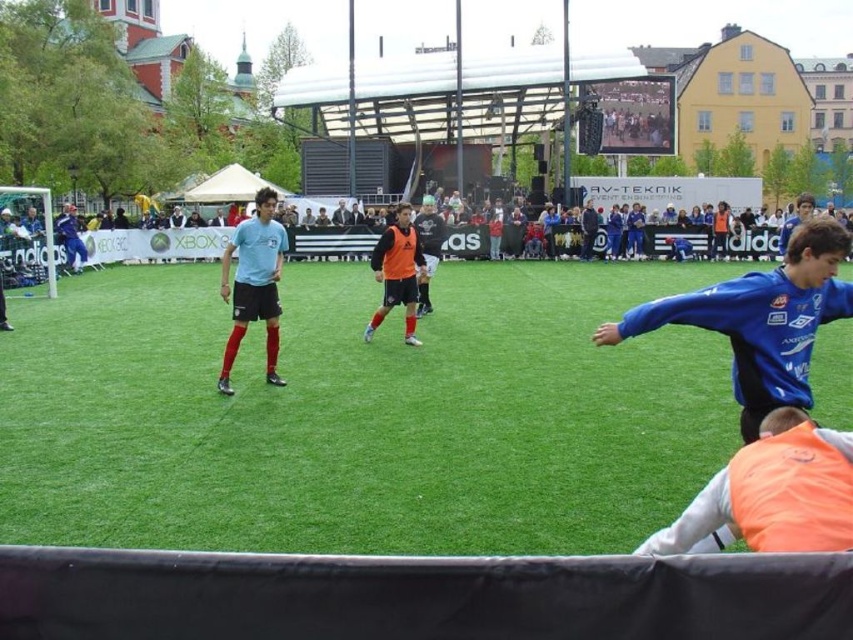
Question: Considering the real-world distances, which object is farthest from the orange matte vest at center?

Choices:
 (A) matte blue jersey at center
 (B) green artificial turf at center

Answer: (B)

Question: Which point is farther to the camera?

Choices:
 (A) orange jersey at center
 (B) blue jersey at center

Answer: (A)

Question: Which point is closer to the camera taking this photo?

Choices:
 (A) (439, 237)
 (B) (798, 401)
 (C) (775, 544)
 (D) (546, 269)

Answer: (C)

Question: Does orange matte vest at lower right appear on the left side of orange jersey at center?

Choices:
 (A) no
 (B) yes

Answer: (A)

Question: Is blue jersey at center thinner than orange jersey at center?

Choices:
 (A) no
 (B) yes

Answer: (A)

Question: Does green artificial turf at center have a smaller size compared to orange matte vest at center?

Choices:
 (A) yes
 (B) no

Answer: (B)